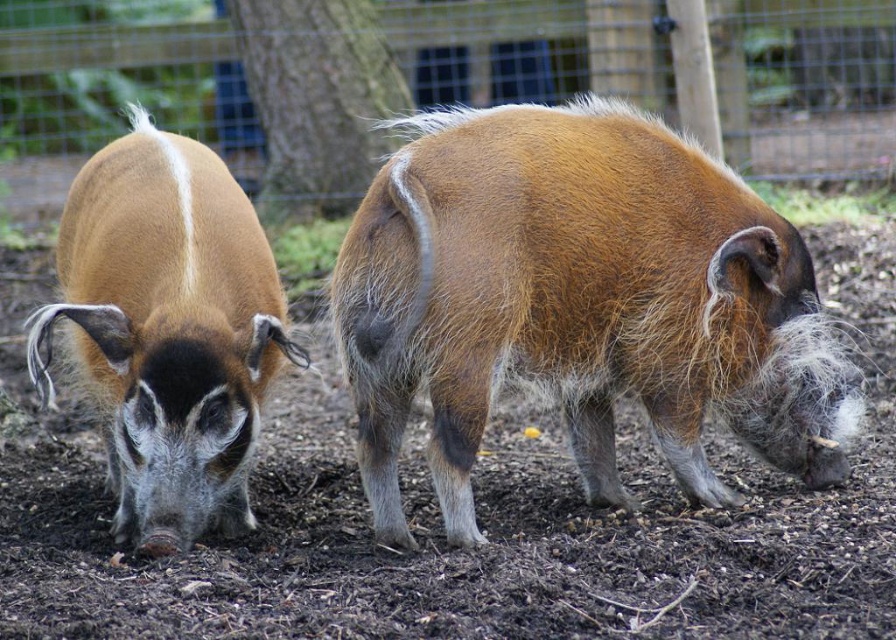
Where is `brown soft mud at center`? Image resolution: width=896 pixels, height=640 pixels. brown soft mud at center is located at coordinates (480, 528).

Does brown soft mud at center have a smaller size compared to brown fuzzy pig at left?

No, brown soft mud at center is not smaller than brown fuzzy pig at left.

Identify the location of brown soft mud at center. (480, 528).

This screenshot has width=896, height=640. Describe the element at coordinates (579, 304) in the screenshot. I see `brown fuzzy pig at center` at that location.

Is brown fuzzy pig at center to the right of metal wire fence at upper center from the viewer's perspective?

Incorrect, brown fuzzy pig at center is not on the right side of metal wire fence at upper center.

Does point (463, 195) lie in front of point (737, 152)?

Yes, it is in front of point (737, 152).

I want to click on brown fuzzy pig at center, so click(x=579, y=304).

Between metal wire fence at upper center and brown fuzzy pig at left, which one is positioned higher?

metal wire fence at upper center

Is metal wire fence at upper center below brown fuzzy pig at left?

Incorrect, metal wire fence at upper center is not positioned below brown fuzzy pig at left.

Who is more distant from viewer, (449, 93) or (240, 438)?

The point (449, 93) is behind.

Where is `metal wire fence at upper center`? Image resolution: width=896 pixels, height=640 pixels. metal wire fence at upper center is located at coordinates (119, 74).